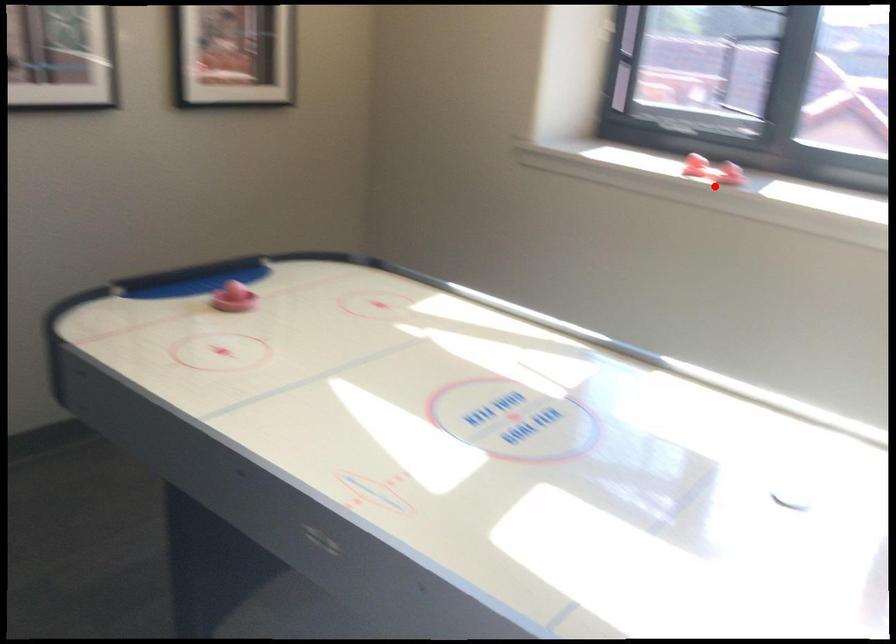
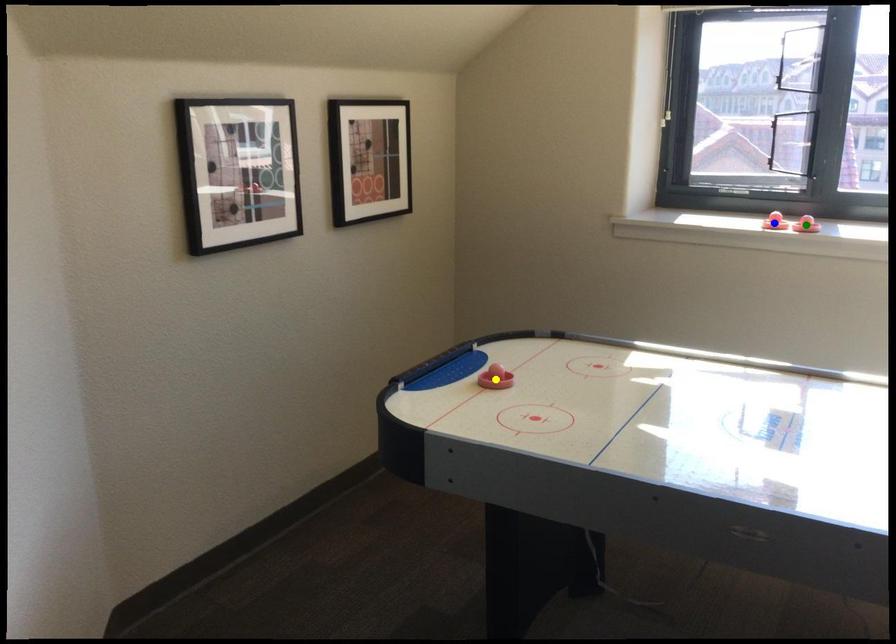
Question: I am providing you with two images of the same scene from different viewpoints. A red point is marked on the first image. You are given multiple points on the second image. Which mark in image 2 goes with the point in image 1?

Choices:
 (A) yellow point
 (B) blue point
 (C) green point

Answer: (C)